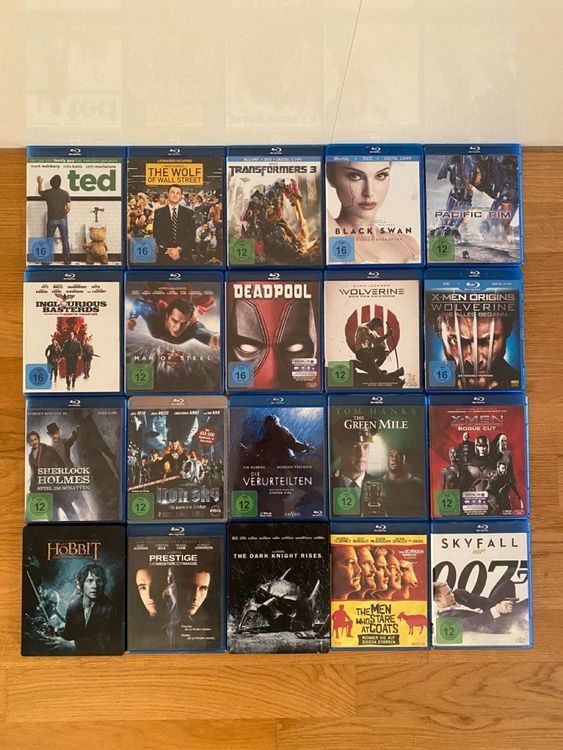
Where is `top row of dvds`? The image size is (563, 750). top row of dvds is located at coordinates (75, 210), (169, 210), (277, 210), (359, 220), (463, 220).